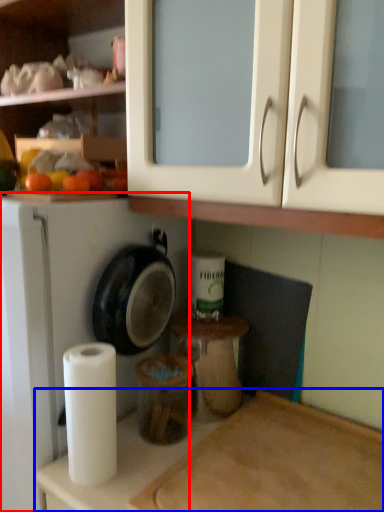
Question: Among these objects, which one is farthest to the camera, dish washer (highlighted by a red box) or counter top (highlighted by a blue box)?

Choices:
 (A) dish washer
 (B) counter top

Answer: (A)